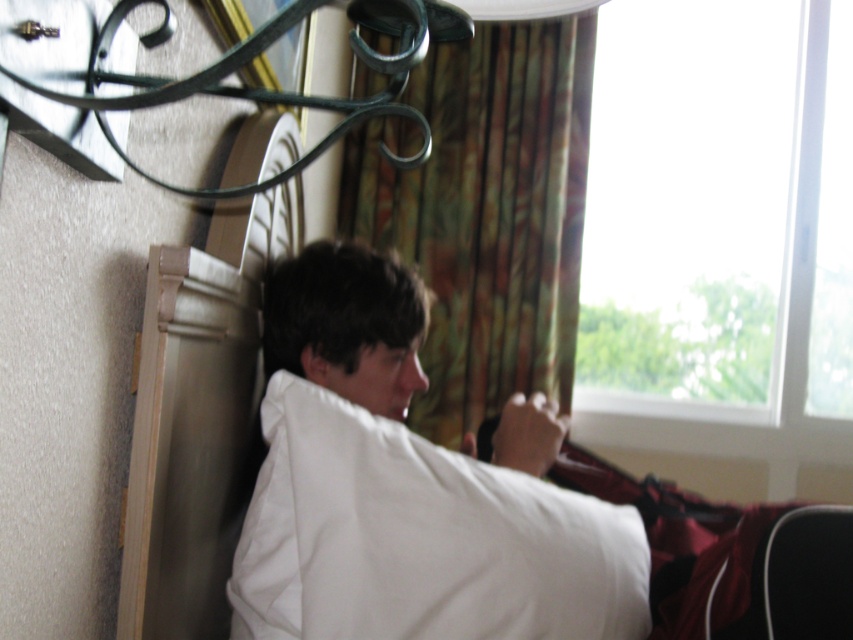
Question: Which object is the farthest from the white soft pillow at center?

Choices:
 (A) multicolored fabric curtain at center
 (B) transparent glass window at upper right

Answer: (B)

Question: Does transparent glass window at upper right have a greater width compared to white soft pillow at center?

Choices:
 (A) yes
 (B) no

Answer: (A)

Question: Which of the following is the closest to the observer?

Choices:
 (A) white soft pillow at center
 (B) multicolored fabric curtain at center
 (C) transparent glass window at upper right

Answer: (A)

Question: Is transparent glass window at upper right positioned in front of white soft pillow at center?

Choices:
 (A) no
 (B) yes

Answer: (A)

Question: Does transparent glass window at upper right have a smaller size compared to white soft pillow at center?

Choices:
 (A) no
 (B) yes

Answer: (A)

Question: Which point is closer to the camera?

Choices:
 (A) multicolored fabric curtain at center
 (B) transparent glass window at upper right
 (C) white soft pillow at center

Answer: (C)